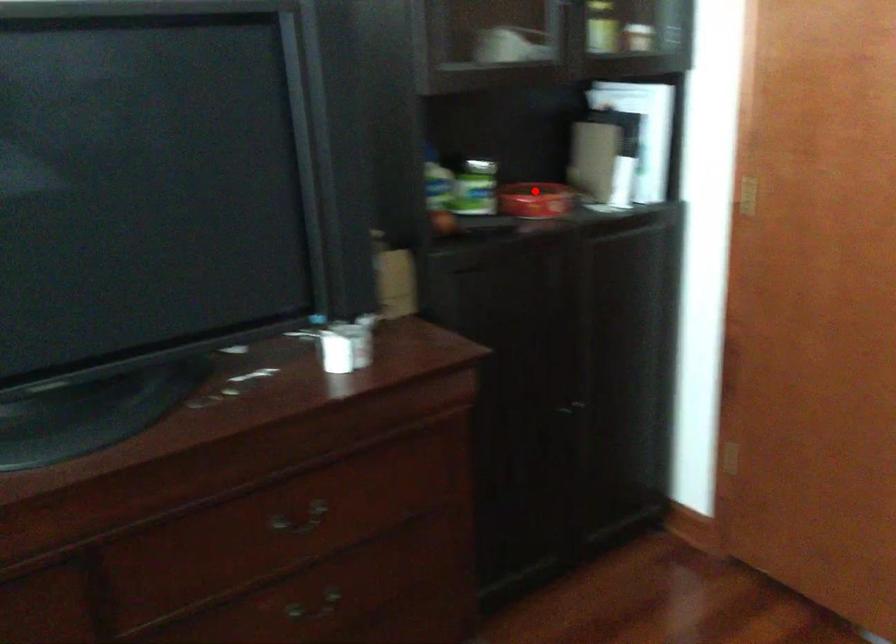
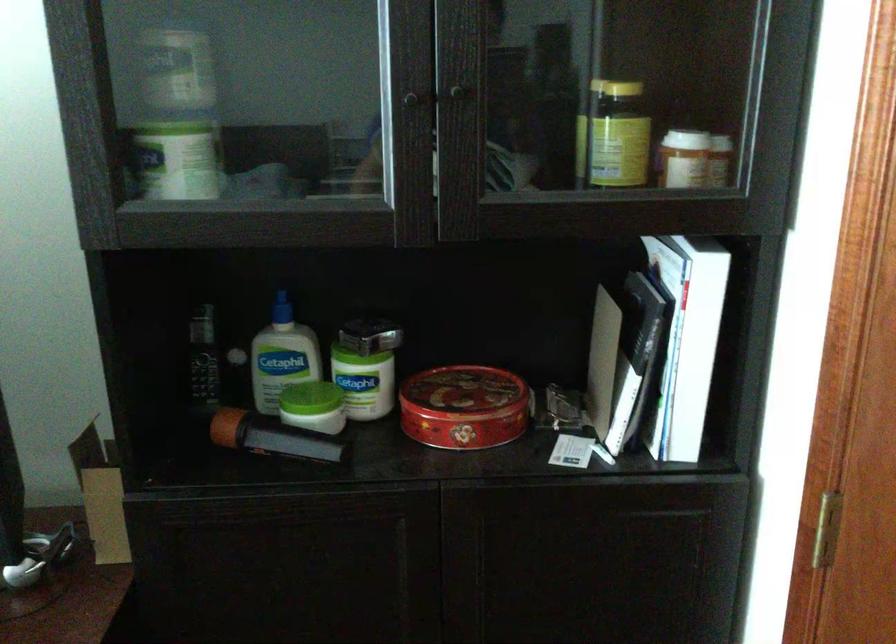
Locate, in the second image, the point that corresponds to the highlighted location in the first image.

(462, 393)